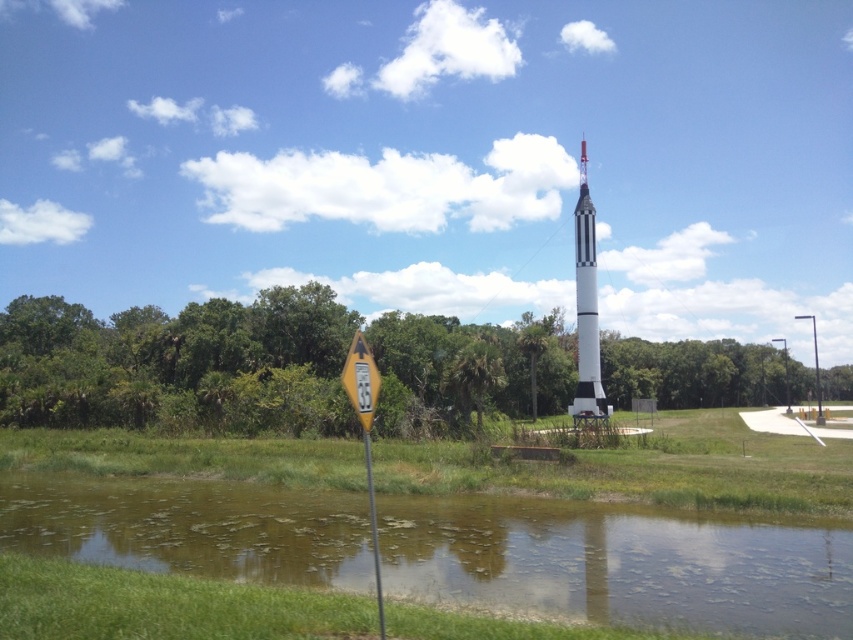
You are standing at the yellow road sign and want to walk towards the two points marked in the scene. Which point will you reach first, point (x=363, y=422) or point (x=367, y=435)?

Point (x=363, y=422) is closer to the viewer than point (x=367, y=435), so you will reach point (x=363, y=422) first.

You are a hiker who wants to place a small marker between the yellow reflective plastic at left and the yellow plastic pole at center. Which object should you place the marker closer to if you want it to be near the smaller object?

The yellow plastic pole at center is smaller than the yellow reflective plastic at left, so you should place the marker closer to the yellow plastic pole at center.